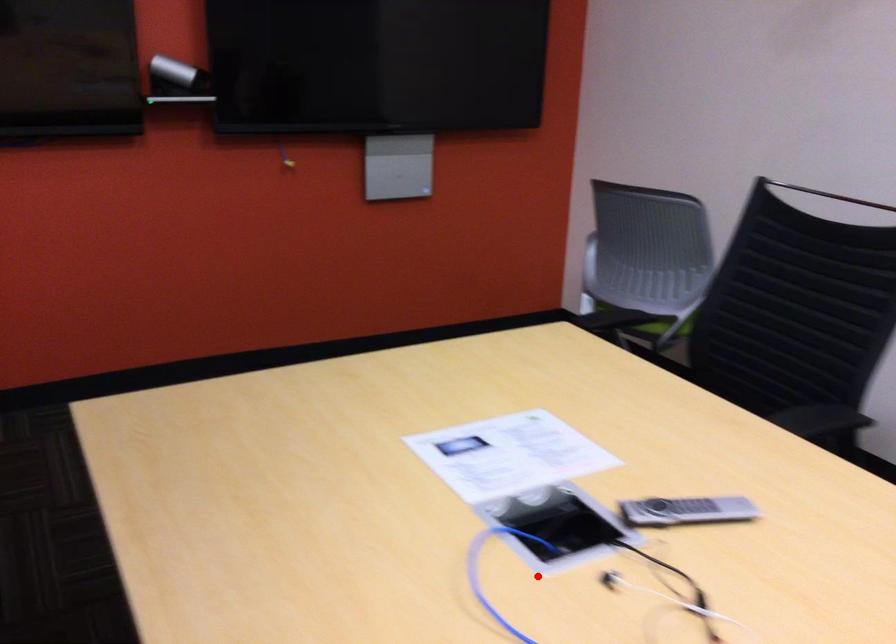
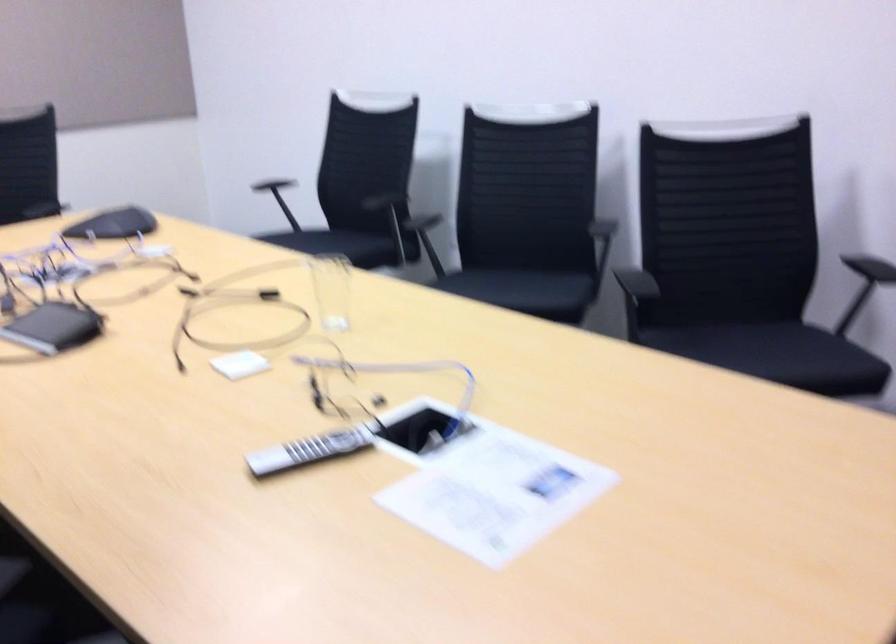
Where in the second image is the point corresponding to the highlighted location from the first image?

(419, 430)